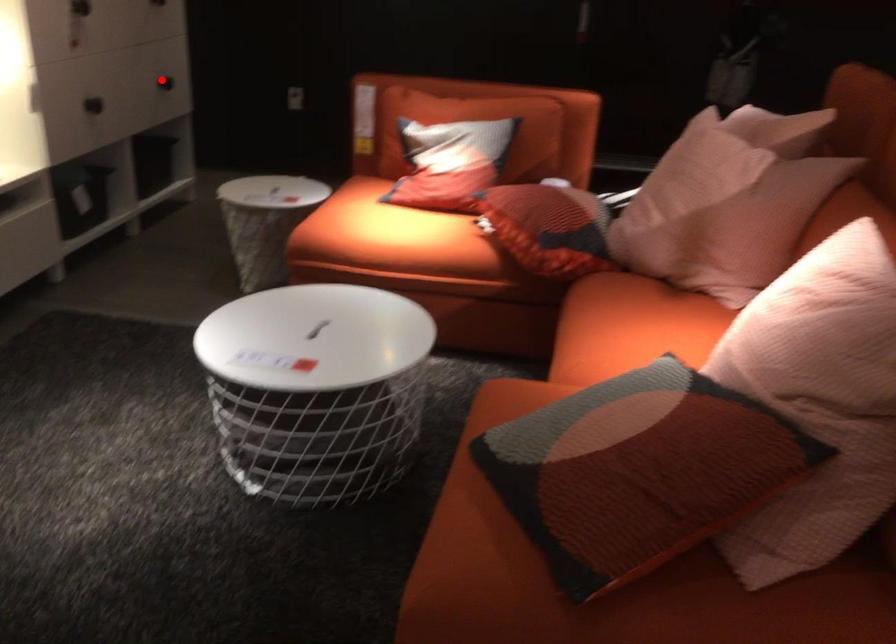
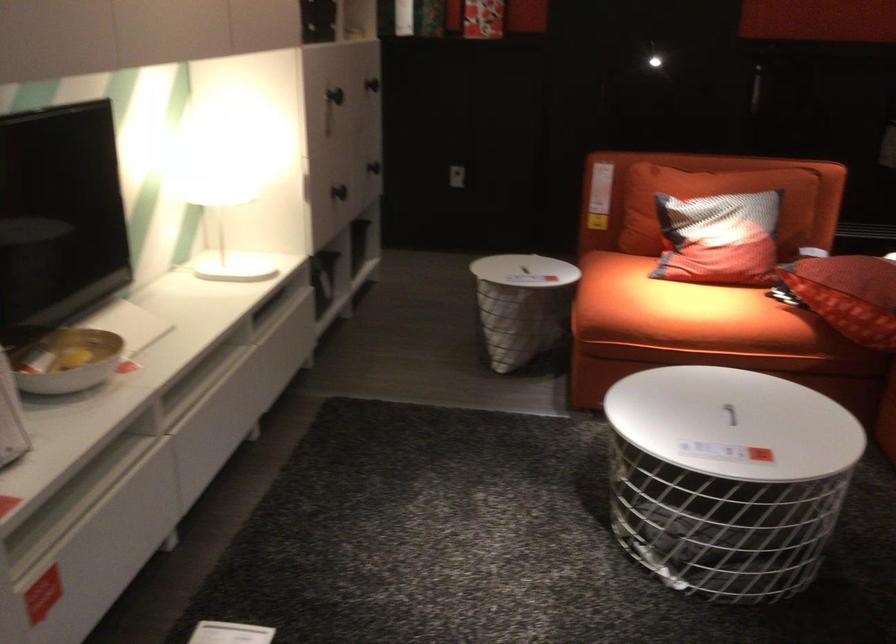
Where in the second image is the point corresponding to the highlighted location from the first image?

(373, 167)